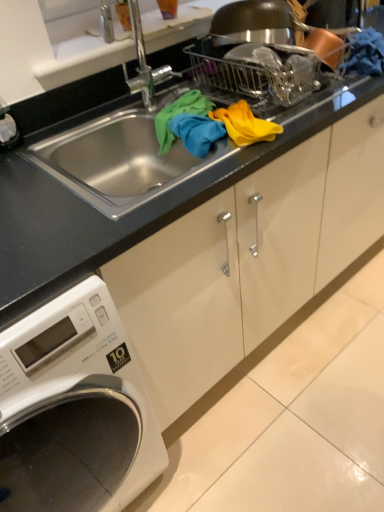
Question: Could you tell me if yellow fabric at upper center is turned towards black granite countertop at center?

Choices:
 (A) no
 (B) yes

Answer: (B)

Question: Does yellow fabric at upper center come behind black granite countertop at center?

Choices:
 (A) no
 (B) yes

Answer: (B)

Question: Does yellow fabric at upper center have a smaller size compared to black granite countertop at center?

Choices:
 (A) yes
 (B) no

Answer: (A)

Question: Is yellow fabric at upper center at the right side of black granite countertop at center?

Choices:
 (A) no
 (B) yes

Answer: (B)

Question: Is yellow fabric at upper center positioned beyond the bounds of black granite countertop at center?

Choices:
 (A) no
 (B) yes

Answer: (A)

Question: Looking at the image, does white glossy washing machine at lower left seem bigger or smaller compared to yellow fabric at upper center?

Choices:
 (A) small
 (B) big

Answer: (B)

Question: Considering the positions of point (99, 423) and point (244, 121), is point (99, 423) closer or farther from the camera than point (244, 121)?

Choices:
 (A) closer
 (B) farther

Answer: (A)

Question: In terms of width, does white glossy washing machine at lower left look wider or thinner when compared to yellow fabric at upper center?

Choices:
 (A) wide
 (B) thin

Answer: (A)

Question: Is white glossy washing machine at lower left situated inside yellow fabric at upper center or outside?

Choices:
 (A) inside
 (B) outside

Answer: (B)

Question: Is yellow fabric at upper center wider or thinner than white glossy washing machine at lower left?

Choices:
 (A) thin
 (B) wide

Answer: (A)

Question: From the image's perspective, is yellow fabric at upper center above or below white glossy washing machine at lower left?

Choices:
 (A) above
 (B) below

Answer: (A)

Question: From a real-world perspective, is yellow fabric at upper center above or below white glossy washing machine at lower left?

Choices:
 (A) above
 (B) below

Answer: (A)

Question: Considering the relative positions of yellow fabric at upper center and white glossy washing machine at lower left in the image provided, is yellow fabric at upper center to the left or to the right of white glossy washing machine at lower left?

Choices:
 (A) right
 (B) left

Answer: (A)

Question: Based on their positions, is yellow fabric at upper center located to the left or right of black granite countertop at center?

Choices:
 (A) left
 (B) right

Answer: (B)

Question: Considering their positions, is yellow fabric at upper center located in front of or behind black granite countertop at center?

Choices:
 (A) behind
 (B) front

Answer: (A)